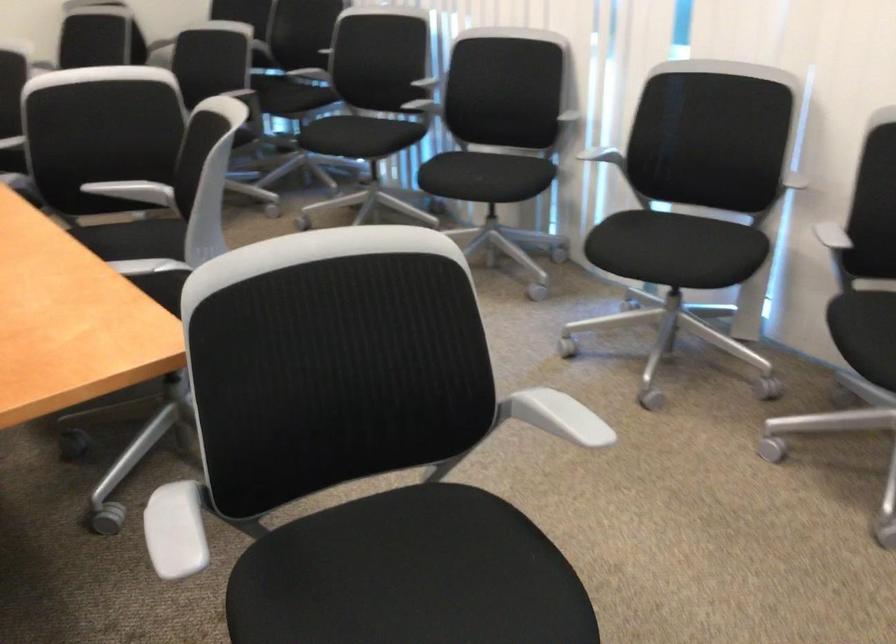
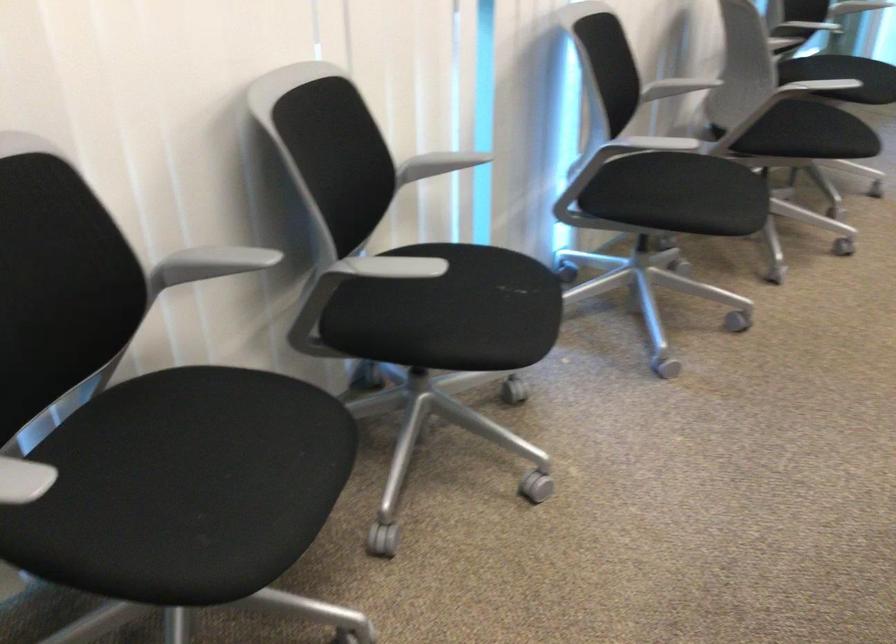
The point at (627, 236) is marked in the first image. Where is the corresponding point in the second image?

(679, 194)